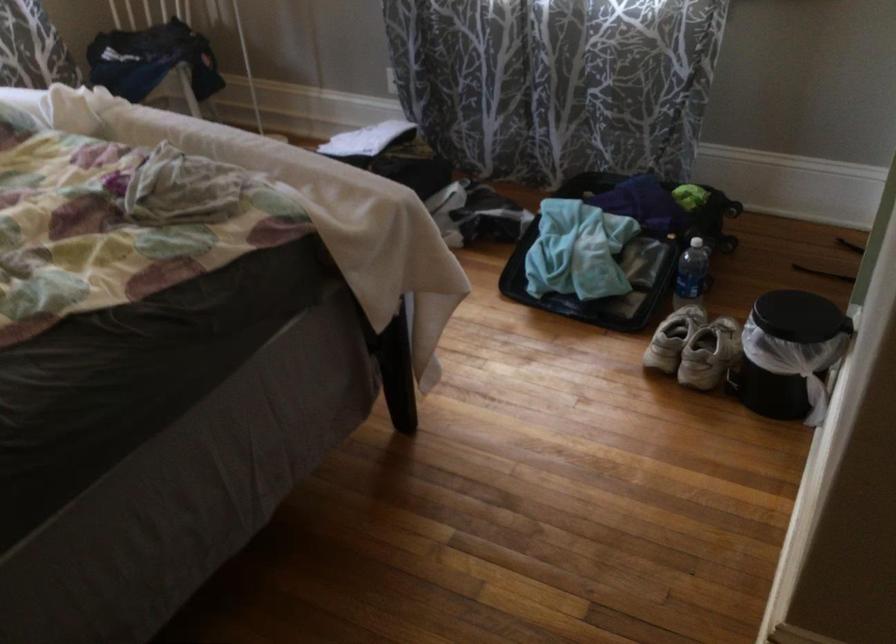
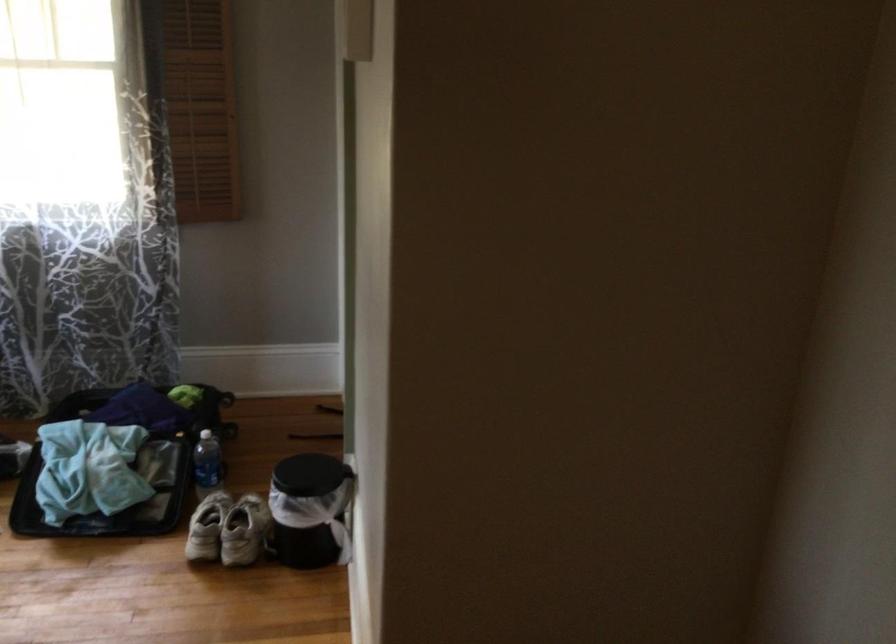
Question: The images are taken continuously from a first-person perspective. In which direction is your viewpoint rotating?

Choices:
 (A) Left
 (B) Right
 (C) Up
 (D) Down

Answer: (B)